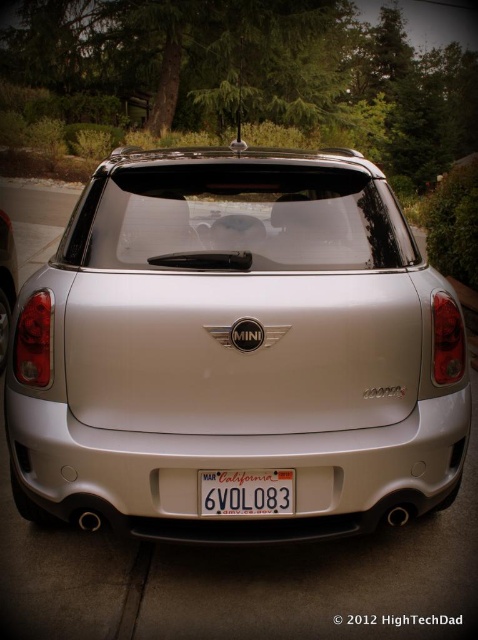
Is satin silver car at center above white plastic license plate at center?

Correct, satin silver car at center is located above white plastic license plate at center.

Locate an element on the screen. The image size is (478, 640). satin silver car at center is located at coordinates (236, 349).

I want to click on satin silver car at center, so click(236, 349).